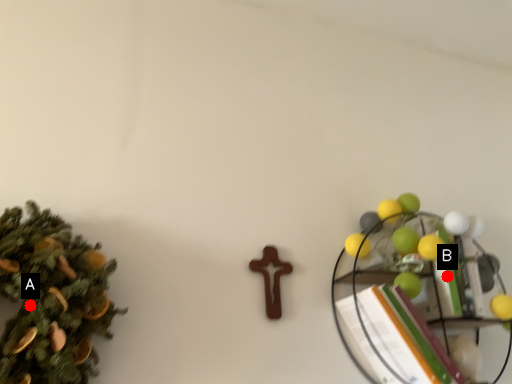
Question: Two points are circled on the image, labeled by A and B beside each circle. Which point is farther to the camera?

Choices:
 (A) A is further
 (B) B is further

Answer: (B)